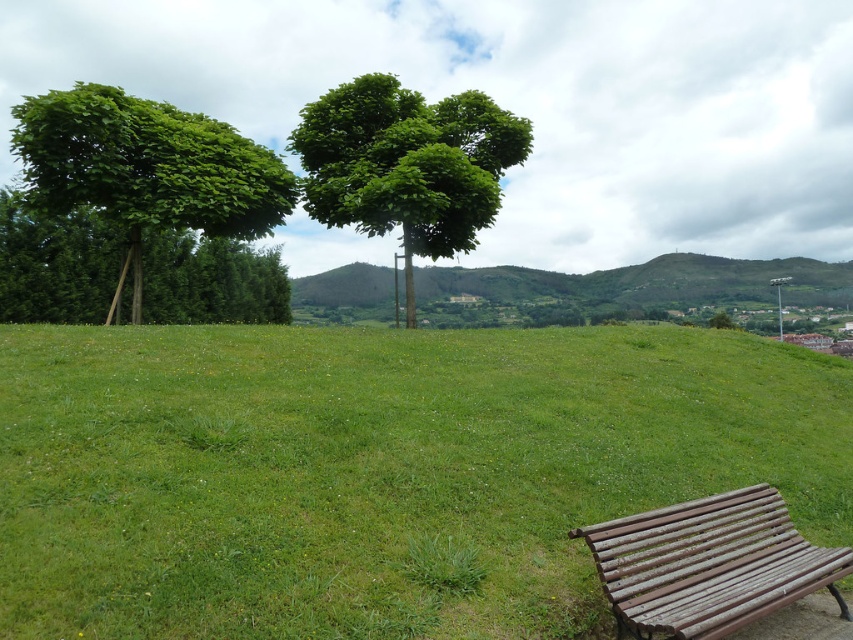
You are standing at the bottom left corner of the image and want to walk towards the green leafy tree at center. Which direction should you turn to avoid the green grassy at lower right?

You should turn left to avoid the green grassy at lower right, as it is located to the right of the green leafy tree at center. Turning left will direct you towards the tree without encountering the grassy area.